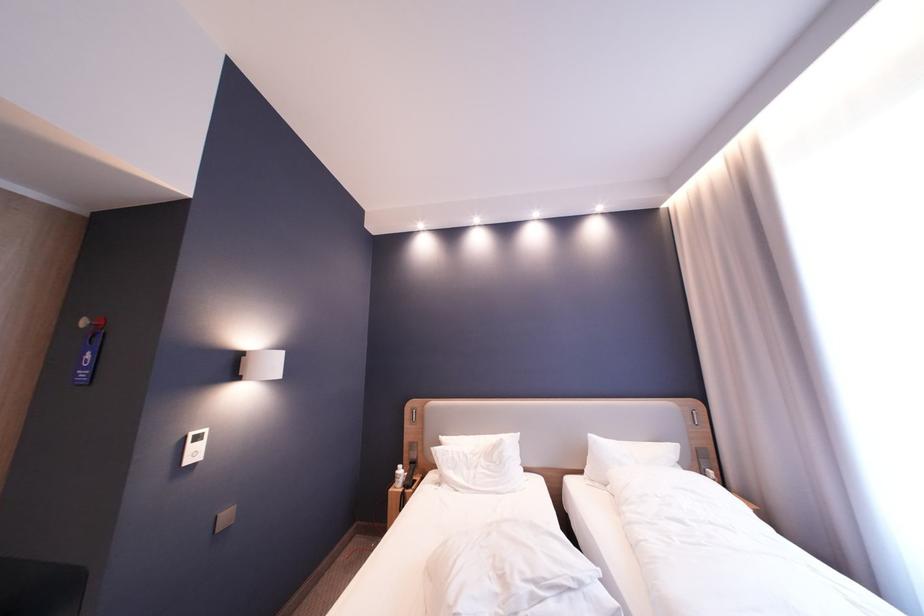
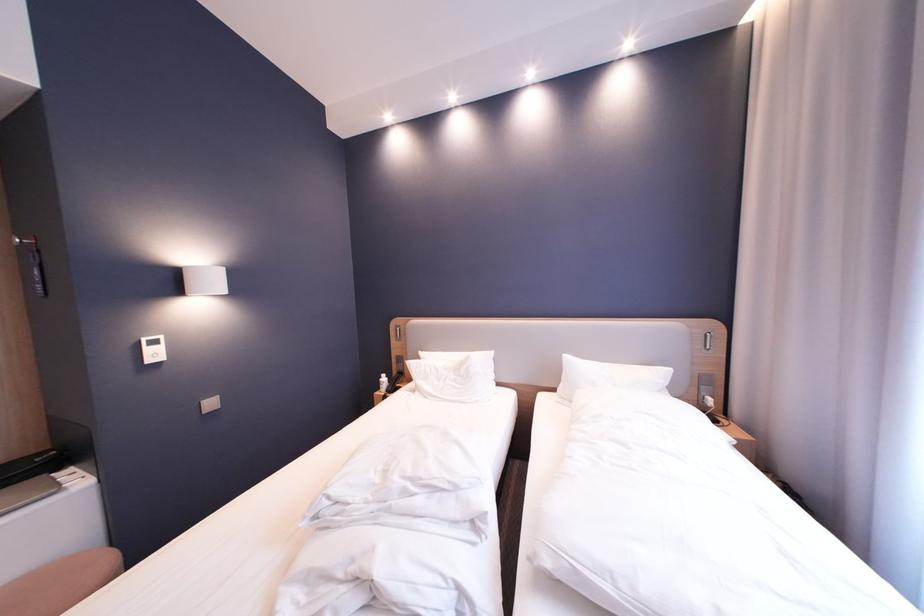
Question: Based on the continuous images, in which direction is the camera rotating? Reply with the corresponding letter.

Choices:
 (A) Left
 (B) Right
 (C) Up
 (D) Down

Answer: (D)